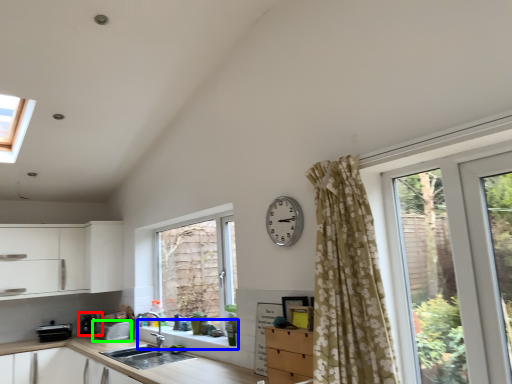
Question: Considering the real-world distances, which object is farthest from appliance (highlighted by a red box)? window sill (highlighted by a blue box) or appliance (highlighted by a green box)?

Choices:
 (A) window sill
 (B) appliance

Answer: (A)